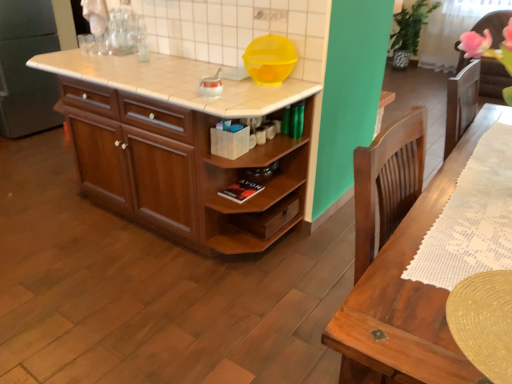
Question: From a real-world perspective, is yellow plastic bowl at upper center, the 1th appliance viewed from the right, physically located above or below white tile countertop at center?

Choices:
 (A) below
 (B) above

Answer: (B)

Question: Is yellow plastic bowl at upper center, which ranks as the second appliance in left-to-right order, bigger or smaller than white tile countertop at center?

Choices:
 (A) big
 (B) small

Answer: (B)

Question: Considering the real-world distances, which object is closest to the white tile countertop at center?

Choices:
 (A) yellow plastic bowl at upper center, the 1th appliance viewed from the right
 (B) white glossy kettle at center, which ranks as the 2th appliance in right-to-left order
 (C) wooden cabinet at center

Answer: (B)

Question: Which is farther from the white glossy kettle at center, which is the first appliance in left-to-right order?

Choices:
 (A) wooden cabinet at center
 (B) white tile countertop at center
 (C) yellow plastic bowl at upper center, the 1th appliance viewed from the right

Answer: (A)